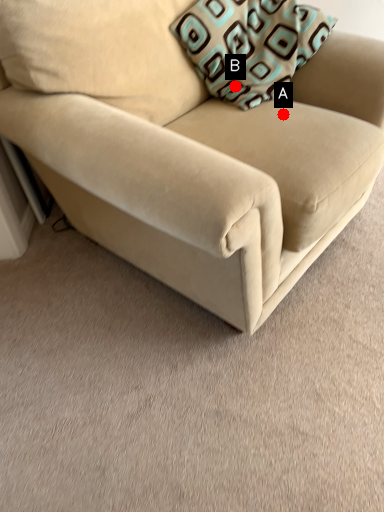
Question: Two points are circled on the image, labeled by A and B beside each circle. Which point is farther from the camera taking this photo?

Choices:
 (A) A is further
 (B) B is further

Answer: (B)